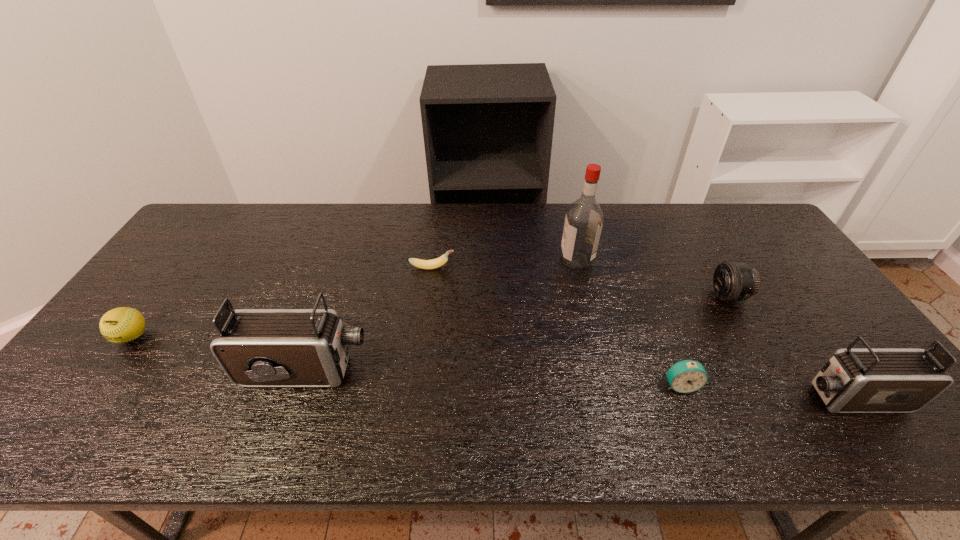
Where is `the fourth nearest object`? the fourth nearest object is located at coordinates 120,325.

Image resolution: width=960 pixels, height=540 pixels. Find the location of `softball`. softball is located at coordinates (120, 325).

Where is `alarm clock`? The image size is (960, 540). alarm clock is located at coordinates (685, 376).

Identify the location of vacant space positioned 0.210m at the lens of the taller camcorder. This screenshot has height=540, width=960. (452, 371).

This screenshot has width=960, height=540. I want to click on free spot located at the lens of the right camcorder, so click(662, 397).

Identify the location of vacant space positioned at the lens of the right camcorder. (654, 397).

I want to click on free region located 0.390m at the lens of the right camcorder, so click(x=633, y=397).

Identify the location of vacant region located 0.390m on the front-facing side of the telephoto lens. (578, 295).

The height and width of the screenshot is (540, 960). What are the coordinates of `vacant area located 0.070m on the front-facing side of the telephoto lens` in the screenshot? It's located at (688, 295).

You are a GUI agent. You are given a task and a screenshot of the screen. Output one action in this format:
    pyautogui.click(x=<x>, y=<y>)
    Task: Click on the vacant space located on the front-facing side of the telephoto lens
    This screenshot has width=960, height=540.
    Given the screenshot: What is the action you would take?
    pyautogui.click(x=578, y=295)